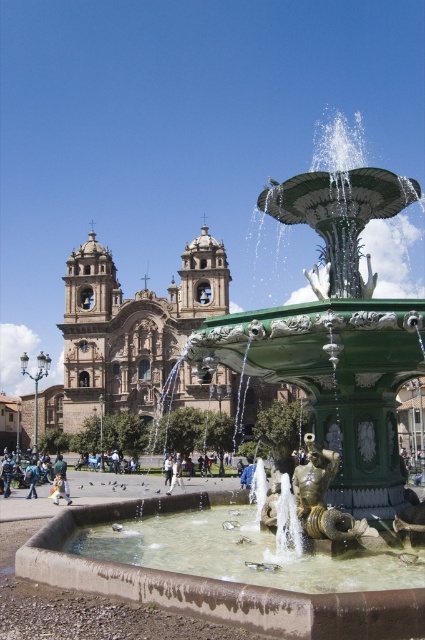
You are a photographer standing at the edge of the square, aiming to capture the fountain and the cathedral in your shot. You notice a person wearing a denim jacket at lower left and white fabric pants at center. Which clothing item is closer to the camera?

The denim jacket at lower left is positioned under the white fabric pants at center, meaning it is closer to the camera.

You are standing in the public square and see a denim jacket at lower left and white fabric pants at center. Which item is shorter in height?

The denim jacket at lower left is shorter than the white fabric pants at center.